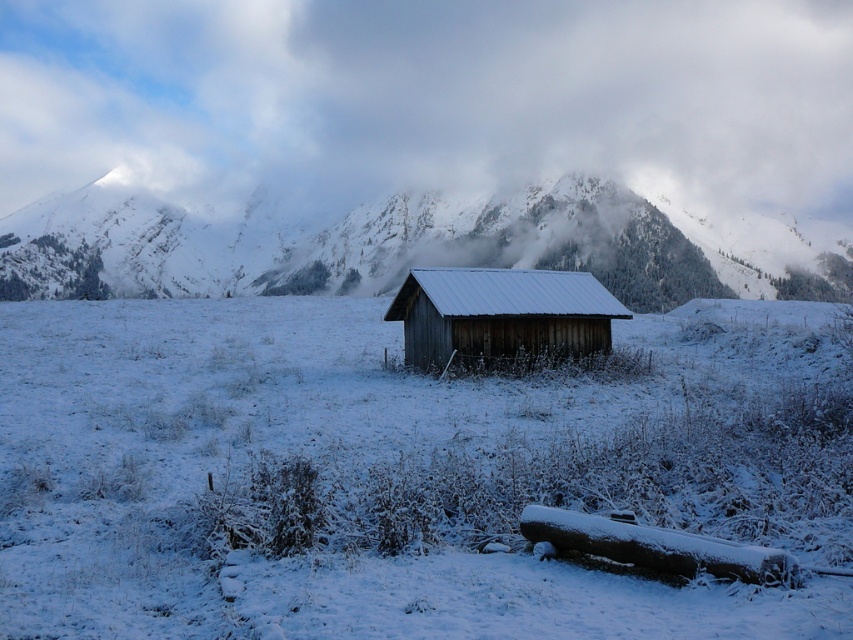
Question: Is snowy wooden mountain at center below wooden cabin at center?

Choices:
 (A) yes
 (B) no

Answer: (B)

Question: Which of the following is the farthest from the observer?

Choices:
 (A) wooden cabin at center
 (B) white fluffy cloud at upper center
 (C) snowy wooden mountain at center

Answer: (B)

Question: Is white fluffy cloud at upper center to the left of snowy wooden mountain at center from the viewer's perspective?

Choices:
 (A) yes
 (B) no

Answer: (A)

Question: Which object is positioned farthest from the wooden cabin at center?

Choices:
 (A) snowy wooden mountain at center
 (B) white fluffy cloud at upper center

Answer: (B)

Question: Which of the following is the closest to the observer?

Choices:
 (A) (312, 83)
 (B) (196, 227)
 (C) (436, 280)

Answer: (C)

Question: Does snowy wooden mountain at center appear on the right side of wooden cabin at center?

Choices:
 (A) yes
 (B) no

Answer: (B)